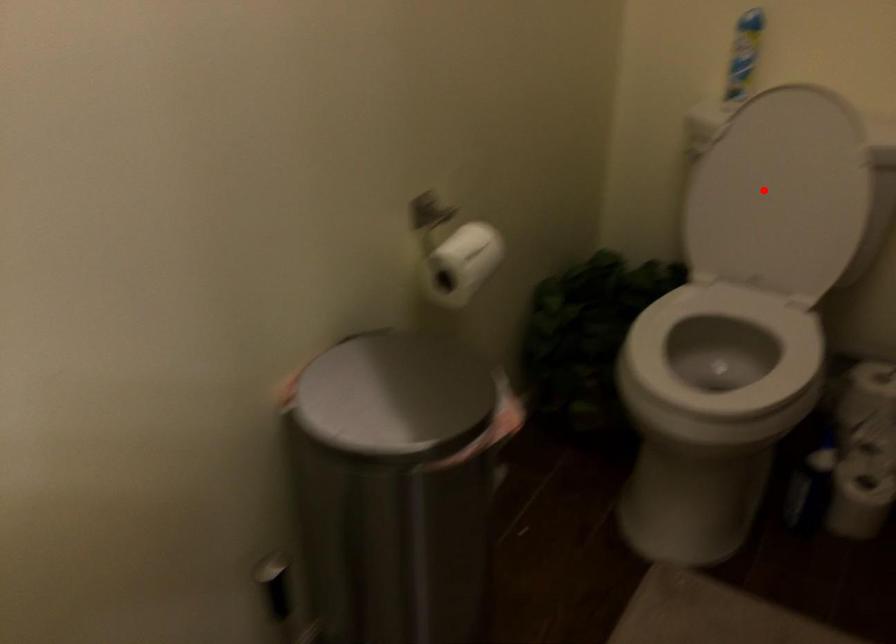
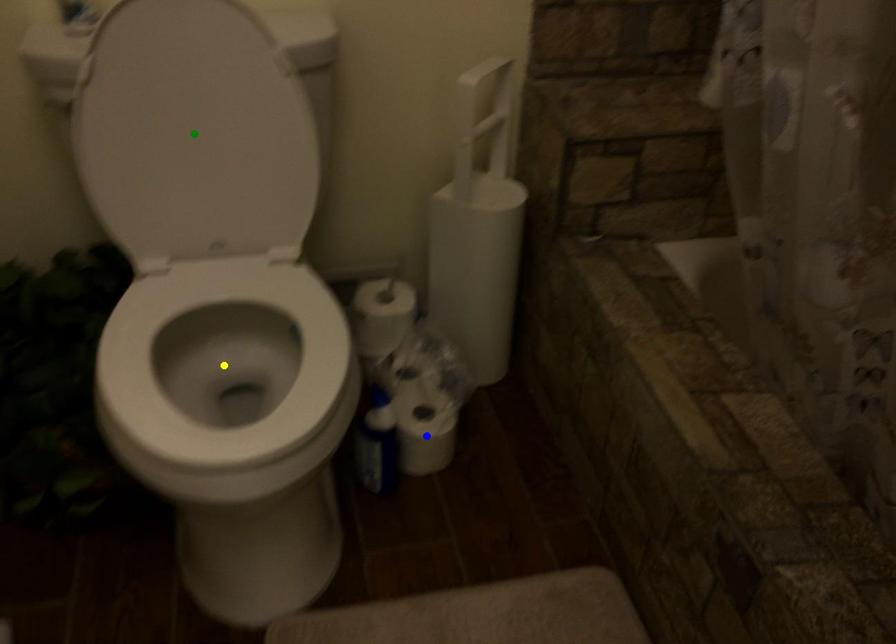
Question: I am providing you with two images of the same scene from different viewpoints. A red point is marked on the first image. You are given multiple points on the second image. Which point in image 2 is actually the same real-world point as the red point in image 1?

Choices:
 (A) blue point
 (B) green point
 (C) yellow point

Answer: (B)